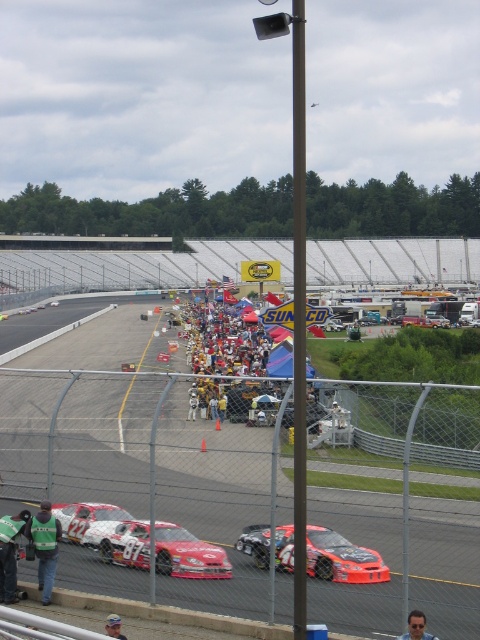
Question: Does orange glossy race car at center appear over green fabric jacket at lower left?

Choices:
 (A) no
 (B) yes

Answer: (B)

Question: Among these objects, which one is nearest to the camera?

Choices:
 (A) smooth asphalt race track at center
 (B) green fabric jacket at lower left

Answer: (A)

Question: Is smooth asphalt race track at center to the right of green fabric jacket at lower left from the viewer's perspective?

Choices:
 (A) yes
 (B) no

Answer: (B)

Question: Does green fabric jacket at lower left have a larger size compared to light blue baseball cap at lower center?

Choices:
 (A) no
 (B) yes

Answer: (B)

Question: Which object is farther from the camera taking this photo?

Choices:
 (A) shiny red car at center
 (B) multicolored fabric crowd at center
 (C) light blue baseball cap at lower center
 (D) blue fabric shirt at lower right

Answer: (B)

Question: Which point is closer to the camera?

Choices:
 (A) (400, 513)
 (B) (106, 545)
 (C) (45, 531)
 (D) (194, 416)

Answer: (A)